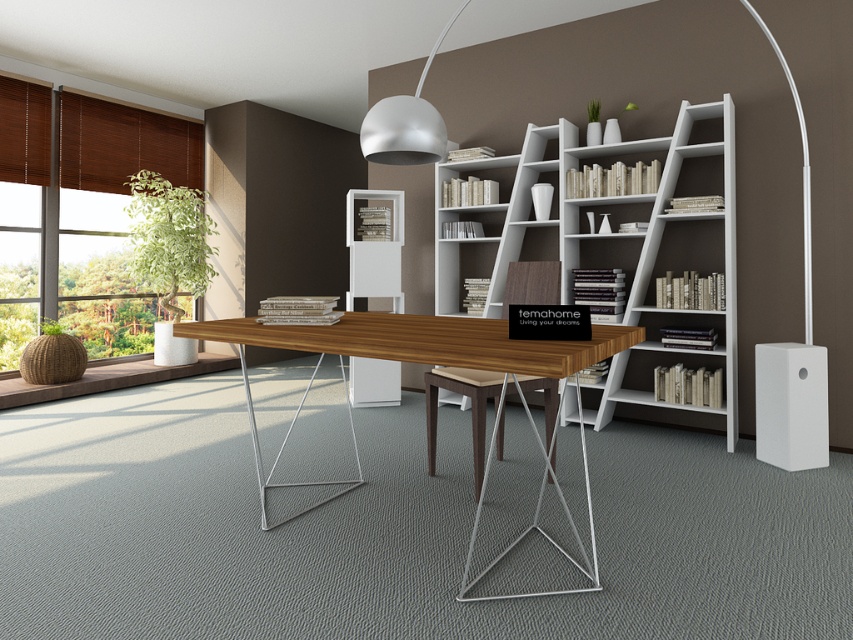
You are setting up a new desk lamp and need to place it between the wooden table at center and the matte white pendant light at upper center. Based on their positions, which object should the lamp be closer to?

The wooden table at center is to the left of the matte white pendant light at upper center. Since the lamp needs to be placed between them, it should be closer to the wooden table at center as it is positioned to the left.

You are setting up a new audio system in the home office. You have a white matte speaker at lower right and a matte white pendant light at upper center. Which object has a smaller width?

The white matte speaker at lower right has a smaller width than the matte white pendant light at upper center.